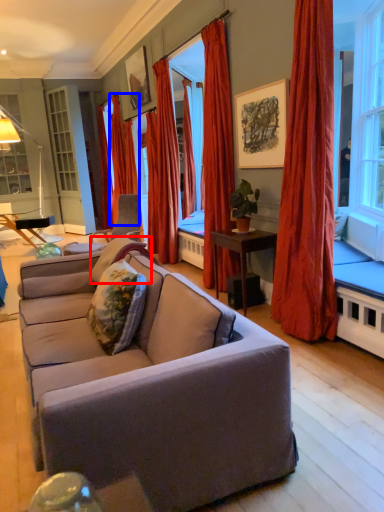
Question: Which object appears closest to the camera in this image, pillow (highlighted by a red box) or curtain (highlighted by a blue box)?

Choices:
 (A) pillow
 (B) curtain

Answer: (A)